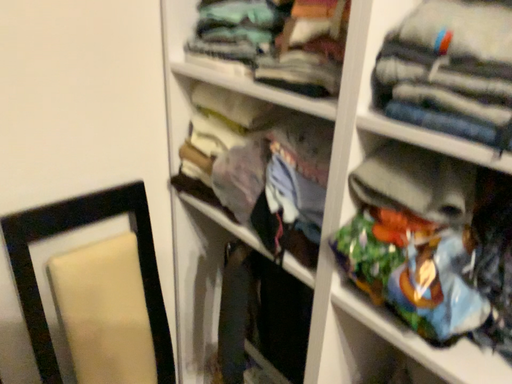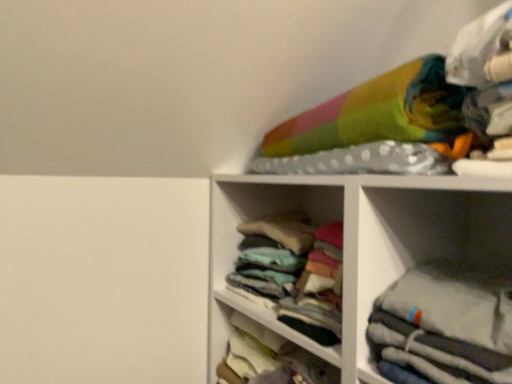
Question: How did the camera likely rotate when shooting the video?

Choices:
 (A) rotated right
 (B) rotated left

Answer: (B)